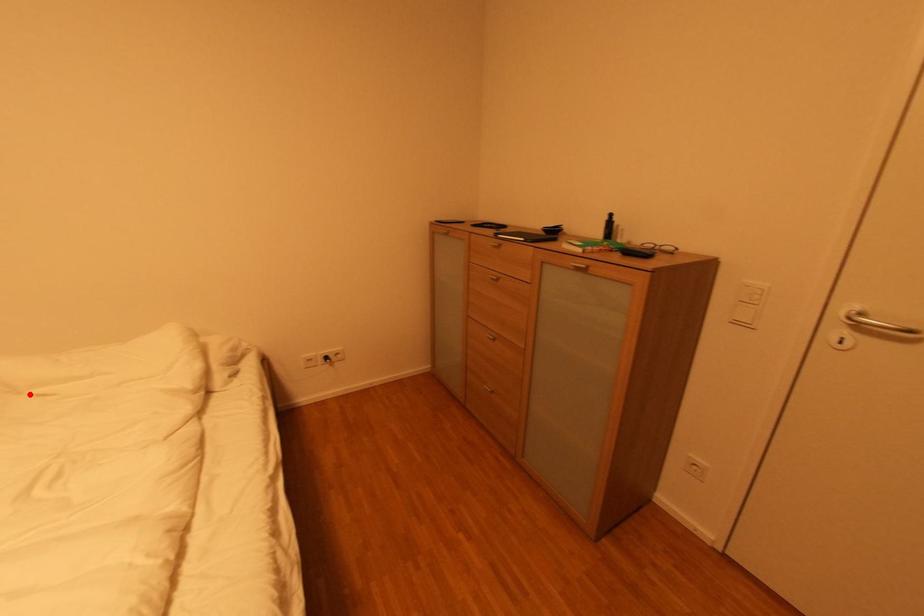
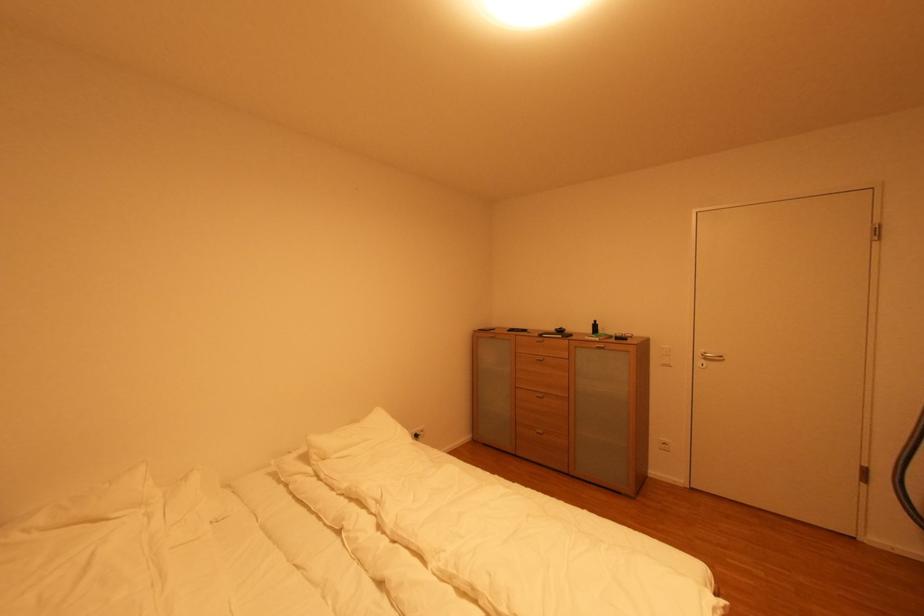
Question: I am providing you with two images of the same scene from different viewpoints. A red point is shown in image1. For the corresponding object point in image2, is it positioned nearer or farther from the camera?

Choices:
 (A) Nearer
 (B) Farther

Answer: (B)